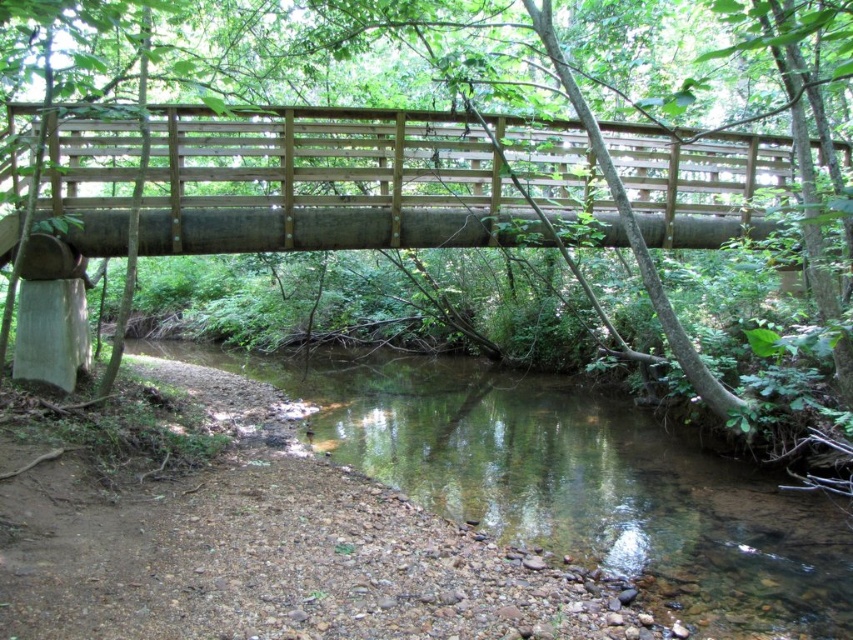
You are planning to cross the stream using the natural wood bridge at center. However, you notice that the clear water at center might be flowing faster than it appears. Considering the height difference between the two, which object is higher and could provide a safer crossing?

The natural wood bridge at center is much taller than the clear water at center, so it is higher and would provide a safer crossing as it is elevated above the water.

From the picture: You are standing at the point with coordinates (326, 182) in the image. What is the object you are currently standing on?

The point (326, 182) is on the natural wood bridge at center, so you are standing on the natural wood bridge at center.

You are a hiker who wants to cross the stream using the bridge. From your position on the bank, which object would you encounter first as you approach the bridge? The natural wood bridge at center or the clear water at center?

You would encounter the natural wood bridge at center first because the clear water at center is located behind it.